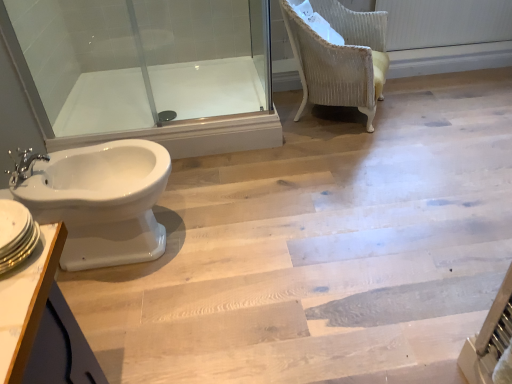
Describe the element at coordinates (340, 57) in the screenshot. This screenshot has height=384, width=512. I see `velvet yellow chair at upper right` at that location.

What do you see at coordinates (16, 234) in the screenshot? This screenshot has height=384, width=512. I see `white glossy sink at lower left` at bounding box center [16, 234].

What do you see at coordinates (101, 201) in the screenshot? I see `white glossy bidet at lower left` at bounding box center [101, 201].

Find the location of a particular element. Image resolution: width=512 pixels, height=384 pixels. velvet yellow chair at upper right is located at coordinates (340, 57).

From a real-world perspective, relative to velvet yellow chair at upper right, is chrome metallic faucet at left vertically above or below?

From a real-world perspective, chrome metallic faucet at left is physically above velvet yellow chair at upper right.

Between chrome metallic faucet at left and velvet yellow chair at upper right, which one appears on the right side from the viewer's perspective?

A: velvet yellow chair at upper right.

In the scene shown: Which of these two, chrome metallic faucet at left or velvet yellow chair at upper right, stands shorter?

With less height is chrome metallic faucet at left.

Who is smaller, chrome metallic faucet at left or velvet yellow chair at upper right?

Smaller between the two is chrome metallic faucet at left.

Locate an element on the screen. chair above the white glossy sink at lower left (from the image's perspective) is located at coordinates (340, 57).

From a real-world perspective, which is physically above, velvet yellow chair at upper right or white glossy sink at lower left?

From a 3D spatial view, white glossy sink at lower left is above.

From the image's perspective, is velvet yellow chair at upper right beneath white glossy sink at lower left?

Actually, velvet yellow chair at upper right appears above white glossy sink at lower left in the image.

Is point (360, 84) closer to viewer compared to point (30, 241)?

No, it is not.

The height and width of the screenshot is (384, 512). In order to click on toilet that is below the velvet yellow chair at upper right (from the image's perspective) in this screenshot , I will do `click(101, 201)`.

Based on the photo, from the image's perspective, is velvet yellow chair at upper right under white glossy bidet at lower left?

Actually, velvet yellow chair at upper right appears above white glossy bidet at lower left in the image.

Is white glossy bidet at lower left surrounded by velvet yellow chair at upper right?

That's incorrect, white glossy bidet at lower left is not inside velvet yellow chair at upper right.

From the picture: From a real-world perspective, is velvet yellow chair at upper right on white glossy bidet at lower left?

Yes, from a real-world perspective, velvet yellow chair at upper right is above white glossy bidet at lower left.

From the image's perspective, which is above, chrome metallic faucet at left or white glossy bathtub at upper left?

white glossy bathtub at upper left is shown above in the image.

Consider the image. Which is closer to the camera, (14, 167) or (172, 80)?

The point (14, 167) is closer to the camera.

Based on the photo, considering the sizes of objects chrome metallic faucet at left and white glossy bathtub at upper left in the image provided, who is bigger, chrome metallic faucet at left or white glossy bathtub at upper left?

white glossy bathtub at upper left is bigger.

Is white glossy bathtub at upper left at the back of chrome metallic faucet at left?

No.

Considering the sizes of objects white glossy bathtub at upper left and white glossy bidet at left in the image provided, who is shorter, white glossy bathtub at upper left or white glossy bidet at left?

Standing shorter between the two is white glossy bidet at left.

This screenshot has height=384, width=512. I want to click on stairwell below the white glossy bathtub at upper left (from the image's perspective), so click(322, 248).

Is white glossy bathtub at upper left with white glossy bidet at left?

white glossy bathtub at upper left and white glossy bidet at left are clearly separated.

In terms of size, does white glossy bathtub at upper left appear bigger or smaller than white glossy bidet at left?

white glossy bathtub at upper left is smaller than white glossy bidet at left.

Could you tell me if white glossy bidet at left is turned towards white glossy bidet at lower left?

No.

Choose the correct answer: Is white glossy bidet at left inside white glossy bidet at lower left or outside it?

white glossy bidet at left is outside white glossy bidet at lower left.

Is white glossy bidet at left wider or thinner than white glossy bidet at lower left?

Considering their sizes, white glossy bidet at left looks broader than white glossy bidet at lower left.

Locate an element on the screen. Image resolution: width=512 pixels, height=384 pixels. toilet located on the left of white glossy bidet at left is located at coordinates (101, 201).

Between white glossy bidet at left and white glossy bathtub at upper left, which one has larger width?

white glossy bidet at left is wider.

Which of these two, white glossy bidet at left or white glossy bathtub at upper left, is smaller?

With smaller size is white glossy bathtub at upper left.

How many degrees apart are the facing directions of white glossy bidet at left and white glossy bathtub at upper left?

They differ by 89 degrees in their facing directions.

Considering the relative positions of white glossy bidet at left and white glossy bathtub at upper left in the image provided, is white glossy bidet at left to the right of white glossy bathtub at upper left from the viewer's perspective?

Correct, you'll find white glossy bidet at left to the right of white glossy bathtub at upper left.

Find the location of `tap in front of the velvet yellow chair at upper right`. tap in front of the velvet yellow chair at upper right is located at coordinates (24, 165).

Locate an element on the screen. The height and width of the screenshot is (384, 512). chair behind the white glossy sink at lower left is located at coordinates (340, 57).

Estimate the real-world distances between objects in this image. Which object is further from white glossy bidet at left, chrome metallic faucet at left or white glossy bidet at lower left?

chrome metallic faucet at left lies further to white glossy bidet at left than the other object.

Estimate the real-world distances between objects in this image. Which object is closer to chrome metallic faucet at left, white glossy sink at lower left or white glossy bathtub at upper left?

Among the two, white glossy sink at lower left is located nearer to chrome metallic faucet at left.

Looking at the image, which one is located further to white glossy bidet at lower left, white glossy sink at lower left or chrome metallic faucet at left?

The object further to white glossy bidet at lower left is white glossy sink at lower left.

Based on their spatial positions, is velvet yellow chair at upper right or white glossy bathtub at upper left closer to white glossy bidet at lower left?

The object closer to white glossy bidet at lower left is white glossy bathtub at upper left.

Considering their positions, is white glossy bathtub at upper left positioned closer to chrome metallic faucet at left than white glossy bidet at lower left?

Based on the image, white glossy bidet at lower left appears to be nearer to chrome metallic faucet at left.

When comparing their distances from white glossy sink at lower left, does white glossy bathtub at upper left or velvet yellow chair at upper right seem further?

velvet yellow chair at upper right.

Looking at the image, which one is located closer to white glossy bidet at lower left, chrome metallic faucet at left or white glossy bathtub at upper left?

Among the two, chrome metallic faucet at left is located nearer to white glossy bidet at lower left.

Considering their positions, is white glossy bidet at left positioned further to white glossy sink at lower left than velvet yellow chair at upper right?

Based on the image, velvet yellow chair at upper right appears to be further to white glossy sink at lower left.

Identify the location of chair located between white glossy bathtub at upper left and white glossy bidet at left in the left-right direction. (340, 57).

The height and width of the screenshot is (384, 512). In order to click on stairwell between white glossy sink at lower left and velvet yellow chair at upper right in the front-back direction in this screenshot , I will do point(322,248).

I want to click on bath between white glossy bidet at lower left and velvet yellow chair at upper right in the horizontal direction, so click(207, 87).

You are a GUI agent. You are given a task and a screenshot of the screen. Output one action in this format:
    pyautogui.click(x=<x>, y=<y>)
    Task: Click on the stairwell between white glossy sink at lower left and white glossy bathtub at upper left from front to back
    The width and height of the screenshot is (512, 384).
    Given the screenshot: What is the action you would take?
    pyautogui.click(x=322, y=248)